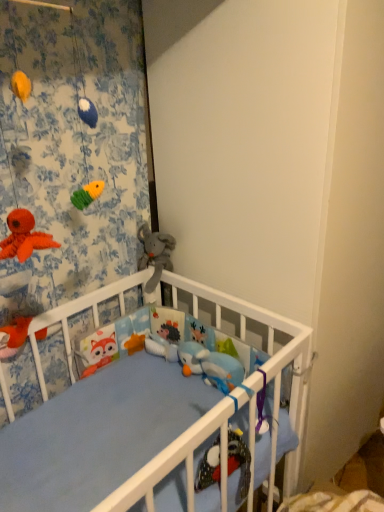
Where is `floral fabric curtain at upper left`? This screenshot has width=384, height=512. floral fabric curtain at upper left is located at coordinates (72, 147).

The image size is (384, 512). Describe the element at coordinates (13, 336) in the screenshot. I see `matte orange plush toy at lower left, acting as the second toy starting from the top` at that location.

This screenshot has width=384, height=512. In order to click on floral fabric curtain at upper left in this screenshot , I will do `click(72, 147)`.

Is soft gray plush elephant at center, the first toy when ordered from top to bottom, facing away from floral fabric curtain at upper left?

No, soft gray plush elephant at center, the first toy when ordered from top to bottom, is not facing away from floral fabric curtain at upper left.

Considering the relative sizes of soft gray plush elephant at center, which appears as the 1th toy when viewed from the right, and floral fabric curtain at upper left in the image provided, is soft gray plush elephant at center, which appears as the 1th toy when viewed from the right, bigger than floral fabric curtain at upper left?

Actually, soft gray plush elephant at center, which appears as the 1th toy when viewed from the right, might be smaller than floral fabric curtain at upper left.

Is soft gray plush elephant at center, the second toy in the front-to-back sequence, not close to floral fabric curtain at upper left?

Actually, soft gray plush elephant at center, the second toy in the front-to-back sequence, and floral fabric curtain at upper left are a little close together.

From the image's perspective, would you say soft gray plush elephant at center, which is counted as the 2th toy, starting from the left, is positioned over matte orange plush toy at lower left, which appears as the second toy when viewed from the right?

Yes, from the image's perspective, soft gray plush elephant at center, which is counted as the 2th toy, starting from the left, is above matte orange plush toy at lower left, which appears as the second toy when viewed from the right.

Considering the relative positions of soft gray plush elephant at center, the first toy when ordered from top to bottom, and matte orange plush toy at lower left, the first toy from the front, in the image provided, is soft gray plush elephant at center, the first toy when ordered from top to bottom, behind matte orange plush toy at lower left, the first toy from the front,?

Yes.

From a real-world perspective, is soft gray plush elephant at center, the first toy when ordered from top to bottom, positioned under matte orange plush toy at lower left, the first toy from the front, based on gravity?

Incorrect, from a real-world perspective, soft gray plush elephant at center, the first toy when ordered from top to bottom, is higher than matte orange plush toy at lower left, the first toy from the front.

Which point is more forward, (x=166, y=264) or (x=7, y=327)?

The point (x=7, y=327) is more forward.

Is floral fabric curtain at upper left completely or partially outside of soft gray plush elephant at center, the second toy in the front-to-back sequence?

Indeed, floral fabric curtain at upper left is completely outside soft gray plush elephant at center, the second toy in the front-to-back sequence.

Can you confirm if floral fabric curtain at upper left is bigger than soft gray plush elephant at center, which ranks as the second toy in bottom-to-top order?

Yes.

Measure the distance from floral fabric curtain at upper left to soft gray plush elephant at center, the second toy in the front-to-back sequence.

12.80 inches.

Is floral fabric curtain at upper left at the right side of soft gray plush elephant at center, the first toy when ordered from top to bottom?

In fact, floral fabric curtain at upper left is to the left of soft gray plush elephant at center, the first toy when ordered from top to bottom.

Between matte orange plush toy at lower left, the first toy from the front, and floral fabric curtain at upper left, which one is positioned behind?

matte orange plush toy at lower left, the first toy from the front, is further from the camera.

Consider the image. How many degrees apart are the facing directions of matte orange plush toy at lower left, which is counted as the 2th toy, starting from the back, and floral fabric curtain at upper left?

The angular difference between matte orange plush toy at lower left, which is counted as the 2th toy, starting from the back, and floral fabric curtain at upper left is 0.971 degrees.

Can you confirm if matte orange plush toy at lower left, which is the first toy in bottom-to-top order, is bigger than floral fabric curtain at upper left?

Actually, matte orange plush toy at lower left, which is the first toy in bottom-to-top order, might be smaller than floral fabric curtain at upper left.

Would you say matte orange plush toy at lower left, which is the first toy in bottom-to-top order, contains soft gray plush elephant at center, which appears as the 1th toy when viewed from the right?

That's incorrect, soft gray plush elephant at center, which appears as the 1th toy when viewed from the right, is not inside matte orange plush toy at lower left, which is the first toy in bottom-to-top order.

Could you tell me if matte orange plush toy at lower left, which appears as the second toy when viewed from the right, is turned towards soft gray plush elephant at center, which appears as the 1th toy when viewed from the right?

No.

Does matte orange plush toy at lower left, acting as the second toy starting from the top, have a larger size compared to soft gray plush elephant at center, which appears as the 1th toy when viewed from the right?

Incorrect, matte orange plush toy at lower left, acting as the second toy starting from the top, is not larger than soft gray plush elephant at center, which appears as the 1th toy when viewed from the right.

Locate an element on the screen. This screenshot has height=512, width=384. toy in front of the soft gray plush elephant at center, the second toy in the front-to-back sequence is located at coordinates (13, 336).

Consider the image. Considering their positions, is floral fabric curtain at upper left located in front of or behind matte orange plush toy at lower left, which appears as the second toy when viewed from the right?

In the image, floral fabric curtain at upper left appears in front of matte orange plush toy at lower left, which appears as the second toy when viewed from the right.

Based on their positions, is floral fabric curtain at upper left located to the left or right of matte orange plush toy at lower left, which appears as the second toy when viewed from the right?

floral fabric curtain at upper left is to the right of matte orange plush toy at lower left, which appears as the second toy when viewed from the right.

Is floral fabric curtain at upper left not near matte orange plush toy at lower left, which is the first toy in left-to-right order?

No, floral fabric curtain at upper left is not far away from matte orange plush toy at lower left, which is the first toy in left-to-right order.

The image size is (384, 512). Find the location of `the 1st toy below when counting from the floral fabric curtain at upper left (from the image's perspective)`. the 1st toy below when counting from the floral fabric curtain at upper left (from the image's perspective) is located at coordinates (155, 254).

This screenshot has width=384, height=512. Identify the location of toy that is under the soft gray plush elephant at center, the second toy in the front-to-back sequence (from a real-world perspective). (13, 336).

Looking at the image, which one is located closer to matte orange plush toy at lower left, which is the first toy in bottom-to-top order, soft gray plush elephant at center, the first toy when ordered from back to front, or floral fabric curtain at upper left?

floral fabric curtain at upper left is positioned closer to the anchor matte orange plush toy at lower left, which is the first toy in bottom-to-top order.

Considering their positions, is floral fabric curtain at upper left positioned further to matte orange plush toy at lower left, the first toy from the front, than soft gray plush elephant at center, which ranks as the second toy in bottom-to-top order?

soft gray plush elephant at center, which ranks as the second toy in bottom-to-top order, is positioned further to the anchor matte orange plush toy at lower left, the first toy from the front.

When comparing their distances from floral fabric curtain at upper left, does matte orange plush toy at lower left, acting as the second toy starting from the top, or soft gray plush elephant at center, which is counted as the 2th toy, starting from the left, seem further?

The object further to floral fabric curtain at upper left is matte orange plush toy at lower left, acting as the second toy starting from the top.

Considering their positions, is matte orange plush toy at lower left, which is the first toy in left-to-right order, positioned closer to soft gray plush elephant at center, which ranks as the second toy in bottom-to-top order, than floral fabric curtain at upper left?

floral fabric curtain at upper left lies closer to soft gray plush elephant at center, which ranks as the second toy in bottom-to-top order, than the other object.

From the image, which object appears to be nearer to soft gray plush elephant at center, which appears as the 1th toy when viewed from the right, floral fabric curtain at upper left or matte orange plush toy at lower left, acting as the second toy starting from the top?

floral fabric curtain at upper left.

Based on their spatial positions, is soft gray plush elephant at center, which is counted as the 2th toy, starting from the left, or matte orange plush toy at lower left, which is the first toy in left-to-right order, closer to floral fabric curtain at upper left?

soft gray plush elephant at center, which is counted as the 2th toy, starting from the left, lies closer to floral fabric curtain at upper left than the other object.

Where is `toy located between floral fabric curtain at upper left and soft gray plush elephant at center, which is counted as the 2th toy, starting from the left, in the depth direction`? toy located between floral fabric curtain at upper left and soft gray plush elephant at center, which is counted as the 2th toy, starting from the left, in the depth direction is located at coordinates (13, 336).